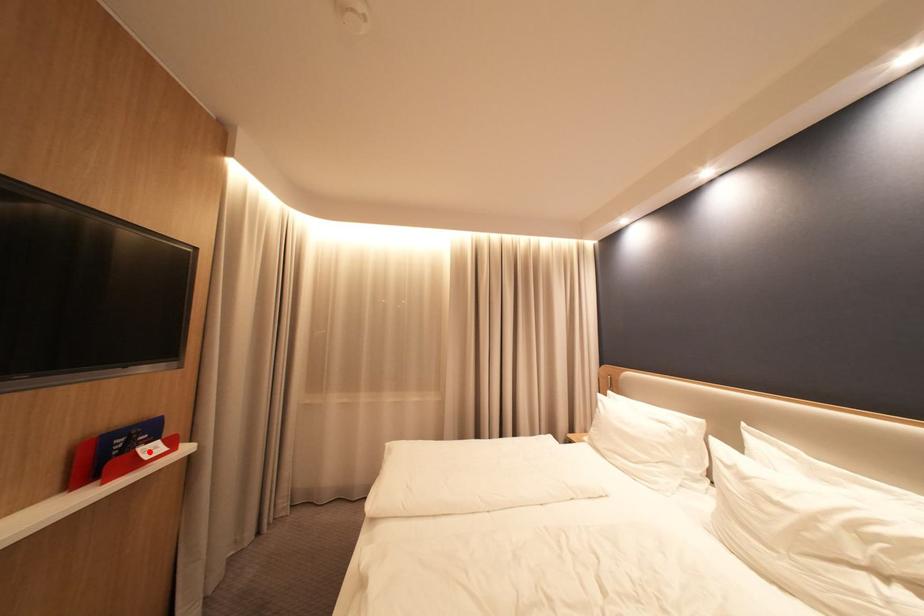
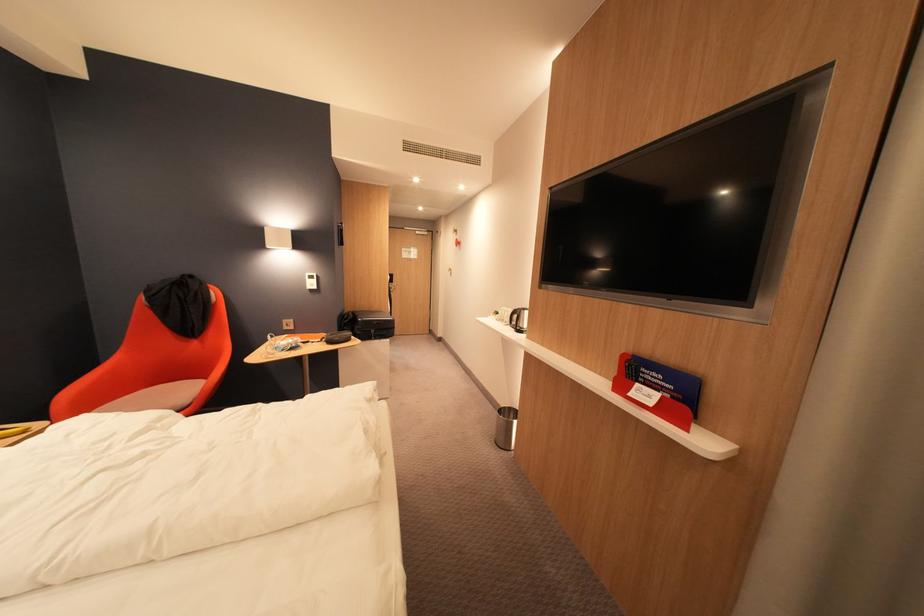
Locate, in the second image, the point that corresponds to the highlighted location in the first image.

(648, 386)